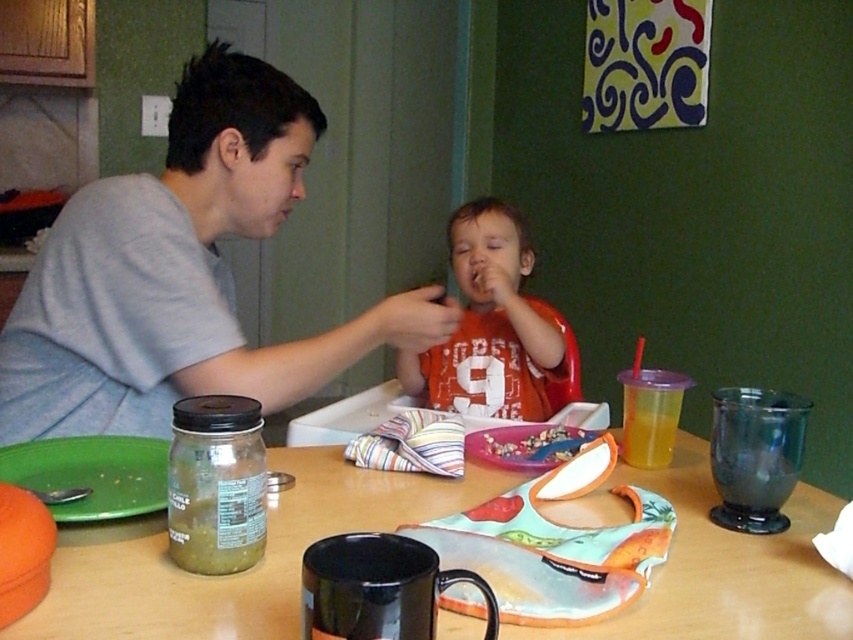
You are standing in the kitchen and looking at two points in the image. The first point is at coordinate point [109,496] and the second is at point [555,452]. Which point is closer to you?

Point [109,496] is closer to the camera than point [555,452].

You are a parent trying to place a toy on the table between the green plastic plate at lower left and the purple plastic tray at center. Which object should you place the toy closer to so it is farther from you?

You should place the toy closer to the purple plastic tray at center because the green plastic plate at lower left is closer to you, so placing it near the purple plastic tray would make it farther from you.